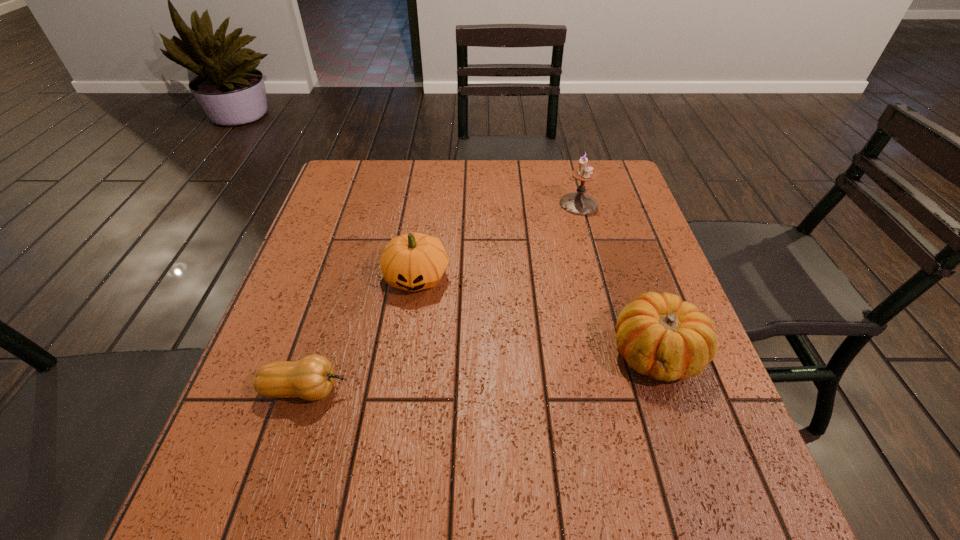
Identify the location of free space between the rightmost gourd and the tallest object. Image resolution: width=960 pixels, height=540 pixels. (617, 278).

Identify the location of free space between the shortest gourd and the farthest object. (442, 297).

Identify the location of object identified as the closest to the farthest object. (414, 261).

Point out which object is positioned as the third nearest to the rightmost gourd. Please provide its 2D coordinates. Your answer should be formatted as a tuple, i.e. [(x, y)], where the tuple contains the x and y coordinates of a point satisfying the conditions above.

[(311, 378)]

This screenshot has height=540, width=960. In order to click on gourd identified as the second closest to the candle holder in this screenshot , I will do point(659,335).

Locate an element on the screen. gourd that stands as the closest to the rightmost gourd is located at coordinates (414, 261).

Locate an element on the screen. The height and width of the screenshot is (540, 960). vacant point that satisfies the following two spatial constraints: 1. on the side of the farthest gourd with the carved face; 2. on the left side of the rightmost gourd is located at coordinates (406, 353).

I want to click on vacant space that satisfies the following two spatial constraints: 1. on the side of the second object from left to right with the carved face; 2. on the stem side of the leftmost object, so click(400, 390).

Where is `vacant position in the image that satisfies the following two spatial constraints: 1. on the side of the rightmost gourd with the carved face; 2. on the right side of the farthest gourd`? This screenshot has width=960, height=540. vacant position in the image that satisfies the following two spatial constraints: 1. on the side of the rightmost gourd with the carved face; 2. on the right side of the farthest gourd is located at coordinates (406, 353).

At what (x,y) coordinates should I click in order to perform the action: click on vacant space that satisfies the following two spatial constraints: 1. on the front side of the rightmost gourd; 2. on the left side of the candle holder. Please return your answer as a coordinate pair (x, y). This screenshot has width=960, height=540. Looking at the image, I should click on (619, 353).